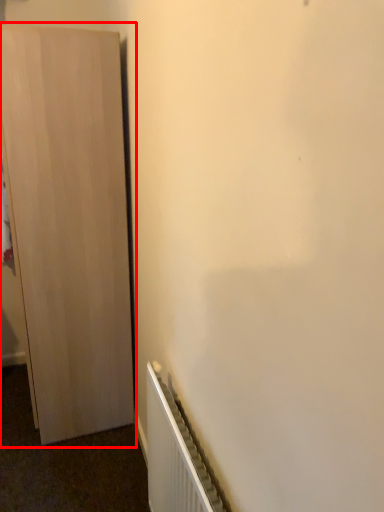
Question: From the image's perspective, what is the correct spatial positioning of cupboard (annotated by the red box) in reference to radiator?

Choices:
 (A) below
 (B) above

Answer: (B)